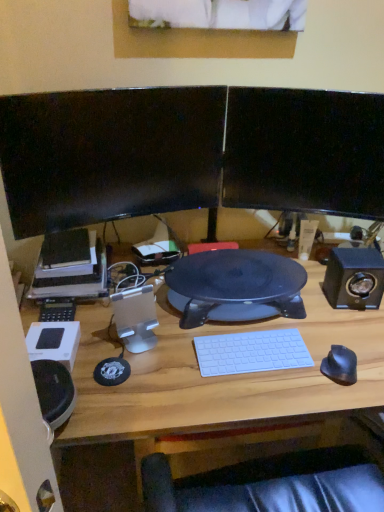
Identify the location of blank space situated above black plastic desk at center (from a real-world perspective). (231, 274).